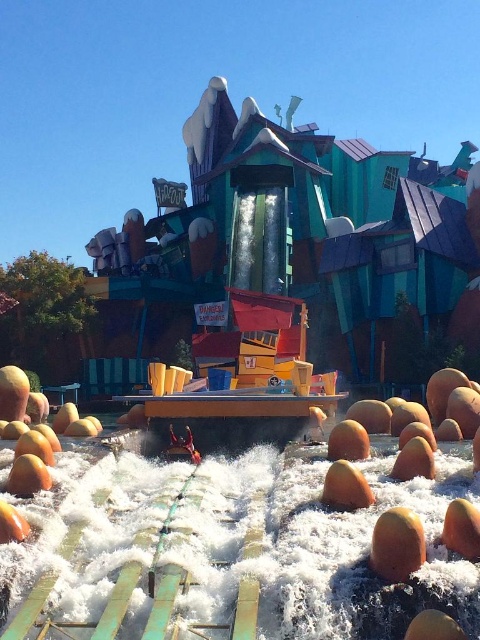
Who is shorter, brown rubber water at lower center or smooth orange fruit at center?

With less height is smooth orange fruit at center.

Between brown rubber water at lower center and smooth orange fruit at center, which one appears on the right side from the viewer's perspective?

From the viewer's perspective, brown rubber water at lower center appears more on the right side.

Is point (375, 458) farther from camera compared to point (330, 497)?

Yes.

I want to click on brown rubber water at lower center, so (x=363, y=550).

The width and height of the screenshot is (480, 640). What do you see at coordinates (363, 550) in the screenshot?
I see `brown rubber water at lower center` at bounding box center [363, 550].

Can you confirm if brown rubber water at lower center is smaller than orange matte fruit at lower center?

No.

Is point (367, 513) less distant than point (451, 625)?

No.

In order to click on brown rubber water at lower center in this screenshot , I will do `click(363, 550)`.

Is brown rubber water at lower center taller than orange matte fruit at lower right?

Correct, brown rubber water at lower center is much taller as orange matte fruit at lower right.

Between brown rubber water at lower center and orange matte fruit at lower right, which one appears on the left side from the viewer's perspective?

orange matte fruit at lower right is more to the left.

Where is `brown rubber water at lower center`? The height and width of the screenshot is (640, 480). brown rubber water at lower center is located at coordinates (363, 550).